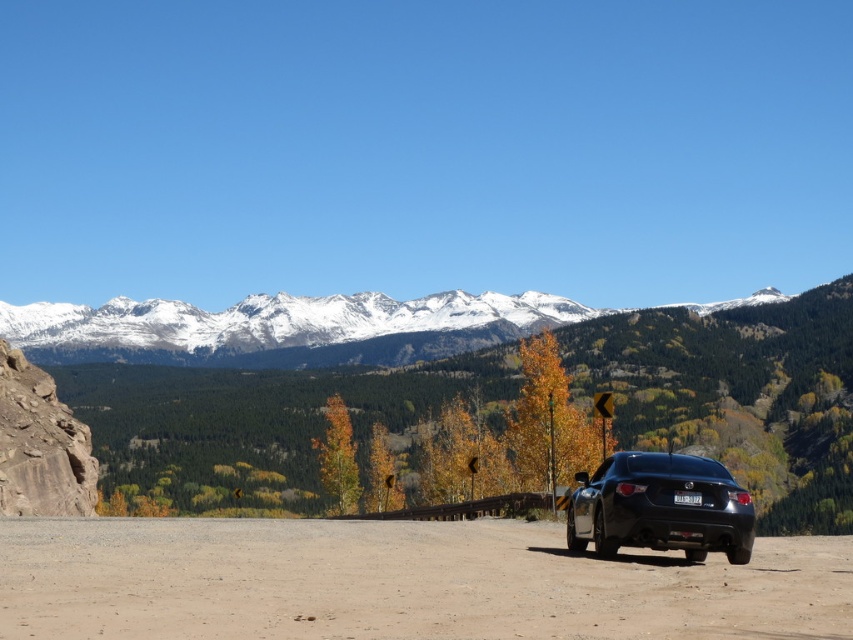
You are a photographer planning to capture the snowy granite mountain range at upper center and the black matte car at right in a single shot. Based on their sizes in the image, which object will appear larger in your photograph?

The snowy granite mountain range at upper center will appear larger in the photograph because it is bigger than the black matte car at right according to the description.